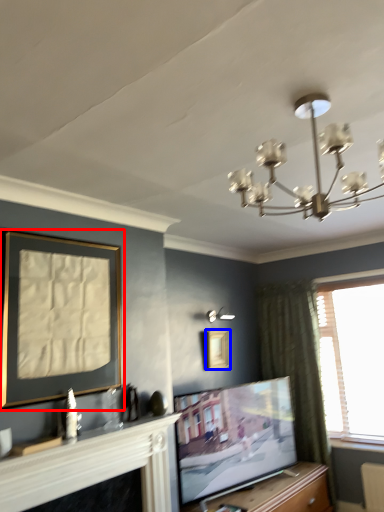
Question: Which of the following is the closest to the observer, picture frame (highlighted by a red box) or picture frame (highlighted by a blue box)?

Choices:
 (A) picture frame
 (B) picture frame

Answer: (A)